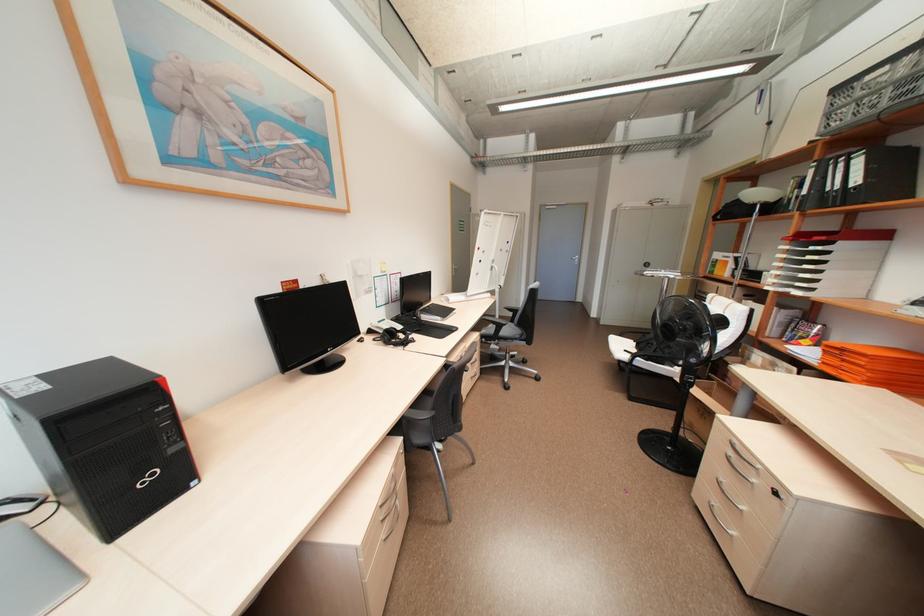
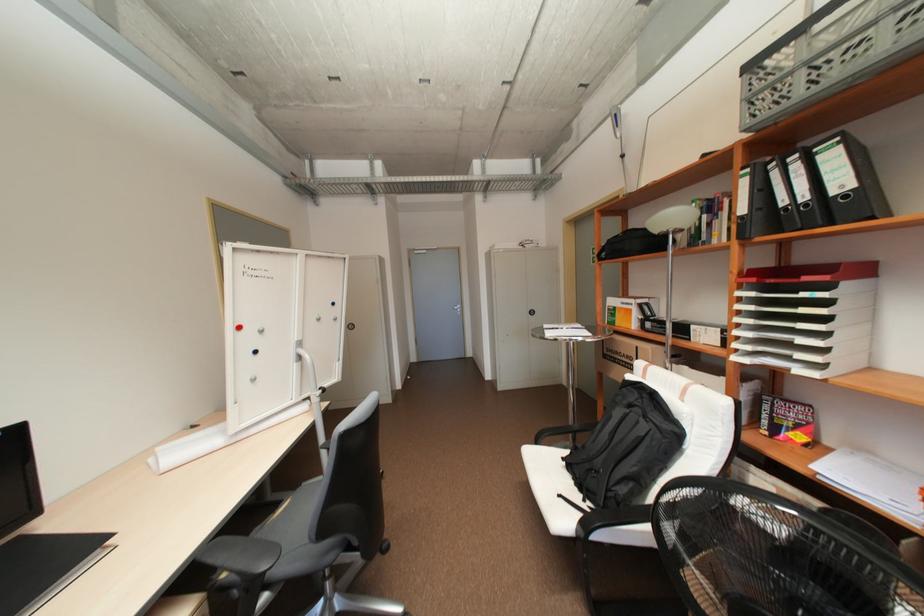
In the second image, find the point that corresponds to point 772,288 in the first image.

(742, 358)